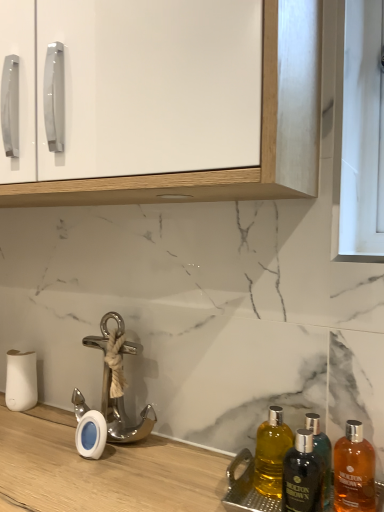
Question: Considering the positions of polished silver anchor at lower left and white glossy cabinet at upper center in the image, is polished silver anchor at lower left taller or shorter than white glossy cabinet at upper center?

Choices:
 (A) tall
 (B) short

Answer: (B)

Question: Is polished silver anchor at lower left situated inside white glossy cabinet at upper center or outside?

Choices:
 (A) outside
 (B) inside

Answer: (A)

Question: Estimate the real-world distances between objects in this image. Which object is closer to the white glossy cabinet at upper center?

Choices:
 (A) yellow glass bottle at lower right, which appears as the 1th bottle when viewed from the left
 (B) dark brown glass bottle at lower right, which is the 2th bottle from right to left
 (C) polished silver anchor at lower left
 (D) shiny amber glass bottle at lower right, the 1th bottle in the right-to-left sequence

Answer: (C)

Question: Which object is the farthest from the shiny amber glass bottle at lower right, the 1th bottle in the right-to-left sequence?

Choices:
 (A) dark brown glass bottle at lower right, the second bottle when ordered from left to right
 (B) polished silver anchor at lower left
 (C) white glossy cabinet at upper center
 (D) yellow glass bottle at lower right, which appears as the 1th bottle when viewed from the left

Answer: (C)